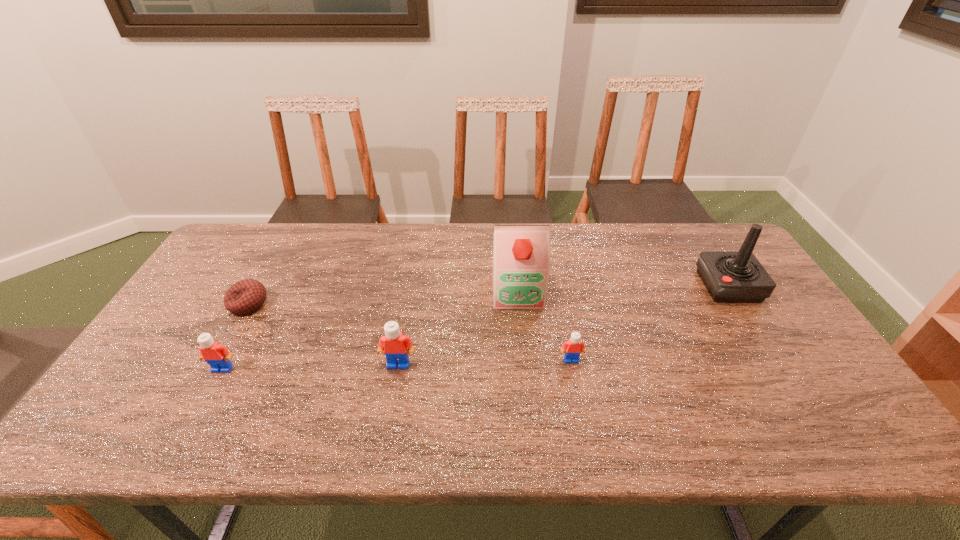
Where is `blank space located on the face of the fourth shortest object`? blank space located on the face of the fourth shortest object is located at coordinates click(x=394, y=390).

The width and height of the screenshot is (960, 540). Identify the location of free location located on the face of the fifth tallest object. (579, 401).

I want to click on vacant region located 0.190m on the back of the beanbag, so click(277, 252).

The image size is (960, 540). What are the coordinates of `vacant position located 0.080m on the front-facing side of the rightmost object` in the screenshot? It's located at (676, 286).

Locate an element on the screen. This screenshot has height=540, width=960. vacant space located on the front-facing side of the rightmost object is located at coordinates (607, 286).

Locate an element on the screen. vacant region located on the front-facing side of the rightmost object is located at coordinates (656, 286).

This screenshot has width=960, height=540. I want to click on vacant space located 0.130m with the cap open on the soya milk, so click(x=522, y=343).

You are a GUI agent. You are given a task and a screenshot of the screen. Output one action in this format:
    pyautogui.click(x=<x>, y=<y>)
    Task: Click on the object present at the left edge
    
    Given the screenshot: What is the action you would take?
    pyautogui.click(x=245, y=296)

This screenshot has width=960, height=540. In order to click on object that is at the right edge in this screenshot , I will do `click(729, 276)`.

In the image, there is a desktop. Identify the location of vacant area at the far edge. (630, 242).